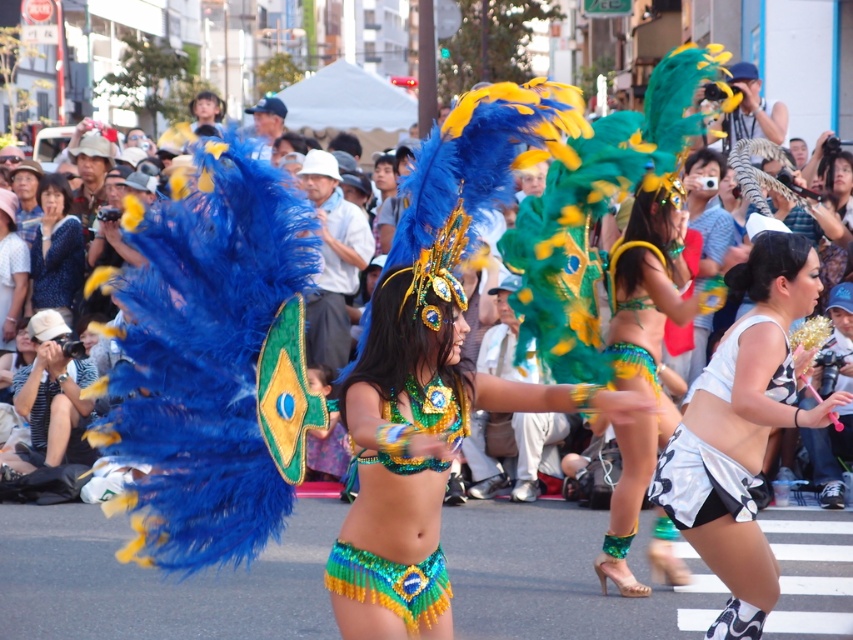
Which is in front, point (256, 417) or point (64, 296)?

Point (256, 417) is in front.

Is matte black camera at upper center taller than blue sequined blouse at upper left?

Correct, matte black camera at upper center is much taller as blue sequined blouse at upper left.

Who is more forward, (282, 264) or (57, 240)?

Point (282, 264) is more forward.

Where is `matte black camera at upper center`? This screenshot has width=853, height=640. matte black camera at upper center is located at coordinates (213, 364).

The width and height of the screenshot is (853, 640). What do you see at coordinates (642, 356) in the screenshot?
I see `green sequined bikini at center` at bounding box center [642, 356].

Is green sequined bikini at center wider than blue sequined blouse at upper left?

Yes, green sequined bikini at center is wider than blue sequined blouse at upper left.

The width and height of the screenshot is (853, 640). What do you see at coordinates (642, 356) in the screenshot?
I see `green sequined bikini at center` at bounding box center [642, 356].

This screenshot has width=853, height=640. I want to click on green sequined bikini at center, so click(x=642, y=356).

Measure the distance between white shiny skirt at center and green sequined bikini at center.

They are 6.29 feet apart.

Is point (787, 305) more distant than point (660, 332)?

No, (787, 305) is closer to viewer.

Which is behind, point (740, 627) or point (637, 513)?

Point (637, 513)

Locate an element on the screen. white shiny skirt at center is located at coordinates (741, 429).